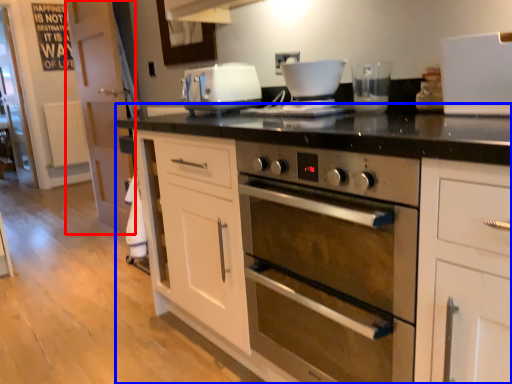
Question: Among these objects, which one is farthest to the camera, glass door (highlighted by a red box) or cabinetry (highlighted by a blue box)?

Choices:
 (A) glass door
 (B) cabinetry

Answer: (A)